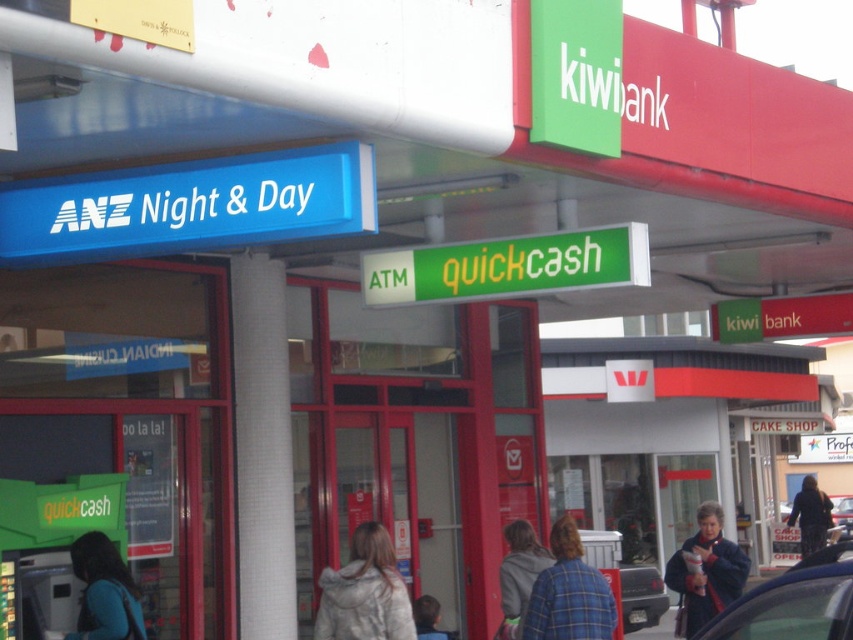
Question: Among these points, which one is farthest from the camera?

Choices:
 (A) (421, 625)
 (B) (518, 520)
 (C) (370, 593)

Answer: (A)

Question: Does green matte atm quickcash at center appear over metallic silver car at lower right?

Choices:
 (A) yes
 (B) no

Answer: (A)

Question: Can you confirm if teal fabric jacket at lower left is bigger than gray woolen jacket at center?

Choices:
 (A) no
 (B) yes

Answer: (A)

Question: Does white fur coat at center lie behind gray woolen jacket at center?

Choices:
 (A) no
 (B) yes

Answer: (A)

Question: Which of the following is the closest to the observer?

Choices:
 (A) (509, 538)
 (B) (813, 509)
 (C) (831, 512)
 (D) (376, 586)

Answer: (D)

Question: Which of the following is the farthest from the observer?

Choices:
 (A) (809, 552)
 (B) (838, 515)

Answer: (B)